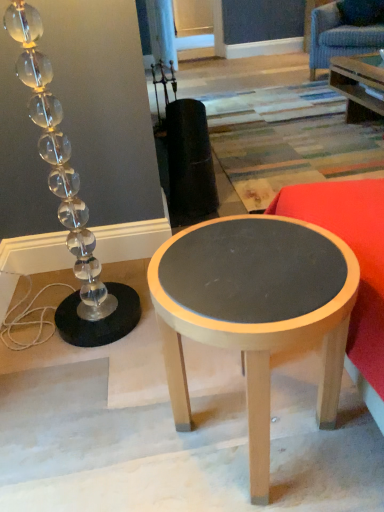
Where is `free region under matte gray wood table at center (from a real-world perspective)`? The image size is (384, 512). free region under matte gray wood table at center (from a real-world perspective) is located at coordinates (246, 428).